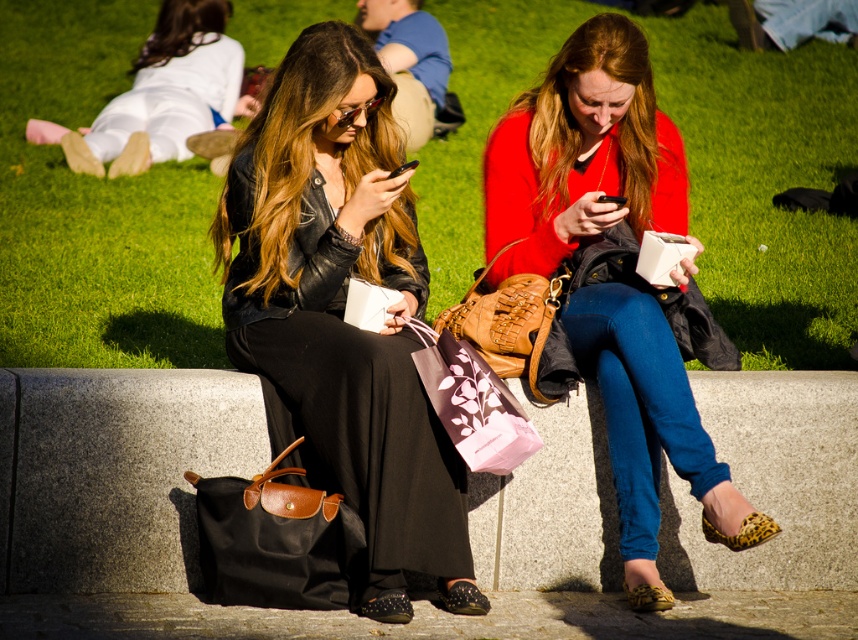
Question: Based on their relative distances, which object is nearer to the matte red sweater at center?

Choices:
 (A) white cotton pants at upper left
 (B) green grass at center
 (C) pink paper bag at center
 (D) black canvas bag at lower left

Answer: (C)

Question: Considering the relative positions of green grass at center and pink paper bag at center in the image provided, where is green grass at center located with respect to pink paper bag at center?

Choices:
 (A) left
 (B) right

Answer: (A)

Question: Which of the following is the farthest from the observer?

Choices:
 (A) (631, 68)
 (B) (29, 284)
 (C) (505, 433)

Answer: (B)

Question: Based on their relative distances, which object is farther from the white cotton pants at upper left?

Choices:
 (A) black canvas bag at lower left
 (B) matte black leather jacket at center
 (C) white matte paper bag at center

Answer: (C)

Question: Is green grass at center to the right of black fabric bag at lower center from the viewer's perspective?

Choices:
 (A) no
 (B) yes

Answer: (A)

Question: Does pink paper bag at center lie behind white matte paper bag at center?

Choices:
 (A) yes
 (B) no

Answer: (B)